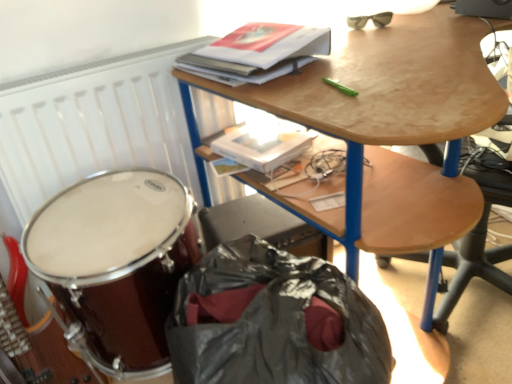
Where is `vacant area to the right of matte black sunglasses at upper right`? The image size is (512, 384). vacant area to the right of matte black sunglasses at upper right is located at coordinates (423, 19).